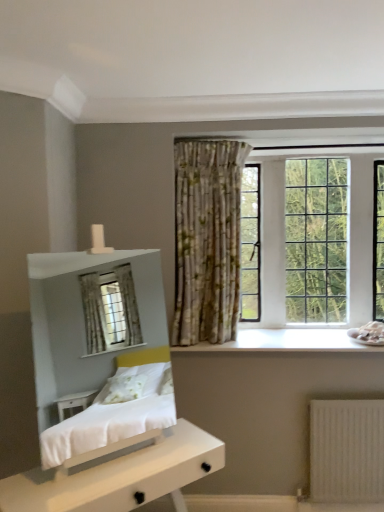
Image resolution: width=384 pixels, height=512 pixels. Describe the element at coordinates (287, 341) in the screenshot. I see `white wood at center` at that location.

The width and height of the screenshot is (384, 512). What do you see at coordinates (284, 209) in the screenshot? I see `clear glass window at upper right` at bounding box center [284, 209].

Locate an element on the screen. The image size is (384, 512). white matte nightstand at lower left is located at coordinates (120, 476).

Which object is thinner, clear glass window at upper right or white wood at center?

With smaller width is clear glass window at upper right.

Locate an element on the screen. window above the white wood at center (from the image's perspective) is located at coordinates (284, 209).

Is white wood at center facing towards white matte nightstand at lower left?

No, white wood at center is not aimed at white matte nightstand at lower left.

Can you tell me how much white wood at center and white matte nightstand at lower left differ in facing direction?

white wood at center and white matte nightstand at lower left are facing 36 degrees away from each other.

Locate an element on the screen. The height and width of the screenshot is (512, 384). nightstand lying below the white wood at center (from the image's perspective) is located at coordinates (120, 476).

Is white wood at center positioned beyond the bounds of white matte nightstand at lower left?

Yes.

Is white matte nightstand at lower left oriented away from clear glass window at upper right?

That's not correct — white matte nightstand at lower left is not looking away from clear glass window at upper right.

Image resolution: width=384 pixels, height=512 pixels. In order to click on window on the right of the white matte nightstand at lower left in this screenshot , I will do `click(284, 209)`.

Who is smaller, white matte nightstand at lower left or clear glass window at upper right?

Smaller between the two is clear glass window at upper right.

Is point (28, 494) closer or farther from the camera than point (323, 141)?

Clearly, point (28, 494) is closer to the camera than point (323, 141).

Considering their positions, is white matte nightstand at lower left located in front of or behind white wood at center?

Visually, white matte nightstand at lower left is located in front of white wood at center.

Considering the relative positions of white matte nightstand at lower left and white wood at center in the image provided, is white matte nightstand at lower left to the right of white wood at center from the viewer's perspective?

Incorrect, white matte nightstand at lower left is not on the right side of white wood at center.

Locate an element on the screen. The width and height of the screenshot is (384, 512). window sill above the white matte nightstand at lower left (from the image's perspective) is located at coordinates [x=287, y=341].

From the image's perspective, between white wood at center and clear glass window at upper right, who is located below?

white wood at center appears lower in the image.

Between white wood at center and clear glass window at upper right, which one appears on the left side from the viewer's perspective?

Positioned to the left is white wood at center.

Is white wood at center touching clear glass window at upper right?

No, white wood at center is not with clear glass window at upper right.

Which object is thinner, white wood at center or clear glass window at upper right?

With smaller width is clear glass window at upper right.

The height and width of the screenshot is (512, 384). Identify the location of nightstand in front of the clear glass window at upper right. (120, 476).

Is clear glass window at upper right not within white matte nightstand at lower left?

Yes.

Looking at this image, who is smaller, clear glass window at upper right or white matte nightstand at lower left?

clear glass window at upper right.

In order to click on window sill that appears on the left of clear glass window at upper right in this screenshot , I will do `click(287, 341)`.

Where is `window sill behind the white matte nightstand at lower left`? window sill behind the white matte nightstand at lower left is located at coordinates (287, 341).

From the image, which object appears to be farther from white matte nightstand at lower left, white wood at center or clear glass window at upper right?

Based on the image, clear glass window at upper right appears to be further to white matte nightstand at lower left.

From the image, which object appears to be farther from clear glass window at upper right, white matte nightstand at lower left or white wood at center?

Based on the image, white matte nightstand at lower left appears to be further to clear glass window at upper right.

Estimate the real-world distances between objects in this image. Which object is closer to clear glass window at upper right, white wood at center or white matte nightstand at lower left?

white wood at center.

When comparing their distances from white wood at center, does white matte nightstand at lower left or clear glass window at upper right seem further?

The object further to white wood at center is white matte nightstand at lower left.

Which object lies further to the anchor point white matte nightstand at lower left, clear glass window at upper right or white wood at center?

Based on the image, clear glass window at upper right appears to be further to white matte nightstand at lower left.

From the image, which object appears to be farther from white wood at center, clear glass window at upper right or white matte nightstand at lower left?

The object further to white wood at center is white matte nightstand at lower left.

Identify the location of window sill between white matte nightstand at lower left and clear glass window at upper right along the z-axis. (287, 341).